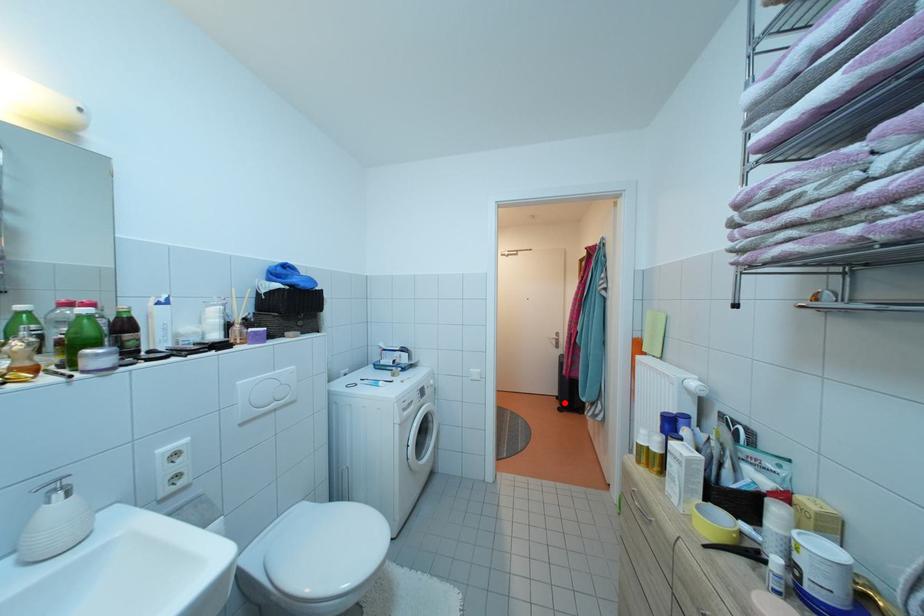
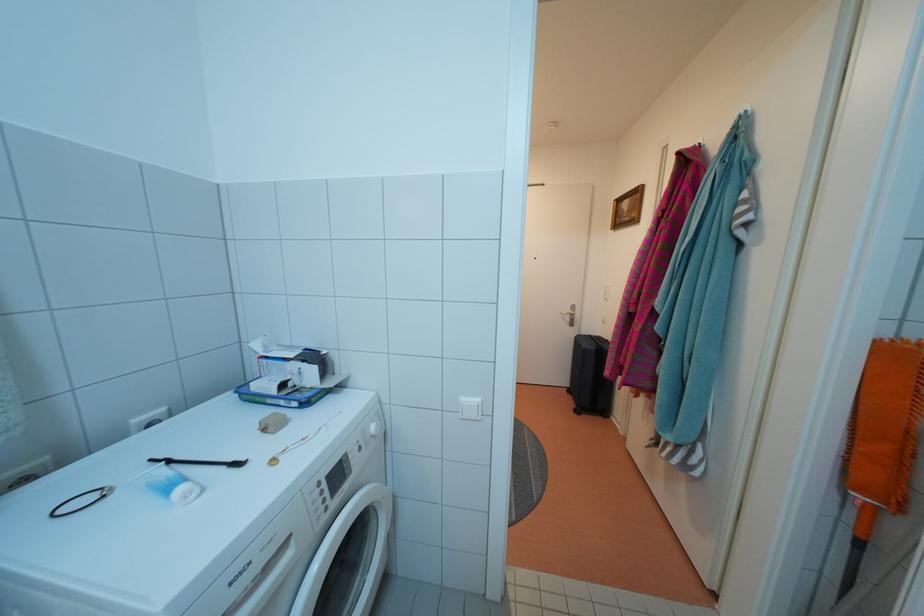
Find the pixel in the second image that matches the highlighted location in the first image.

(576, 397)